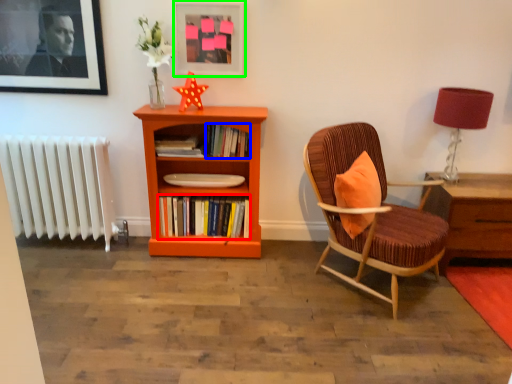
Question: Considering the real-world distances, which object is closest to book (highlighted by a red box)? book (highlighted by a blue box) or picture frame (highlighted by a green box).

Choices:
 (A) book
 (B) picture frame

Answer: (A)